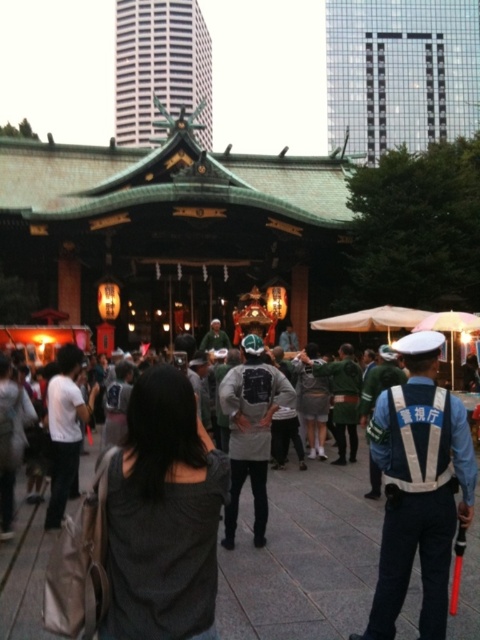
Which is below, green matte temple at upper center or dark gray fabric backpack at lower left?

Positioned lower is dark gray fabric backpack at lower left.

Is green matte temple at upper center positioned behind dark gray fabric backpack at lower left?

Yes, green matte temple at upper center is further from the viewer.

Does point (159, 49) come farther from viewer compared to point (7, 490)?

Yes, point (159, 49) is farther from viewer.

Image resolution: width=480 pixels, height=640 pixels. What are the coordinates of `green matte temple at upper center` in the screenshot? It's located at (160, 68).

Does green glazed tile temple at upper center lie behind gray fabric backpack at center?

That is True.

Who is more distant from viewer, (352,28) or (253,536)?

The point (352,28) is more distant.

Locate an element on the screen. The width and height of the screenshot is (480, 640). green glazed tile temple at upper center is located at coordinates (400, 72).

Does dark gray fabric crowd at center appear over green matte temple at upper center?

No, dark gray fabric crowd at center is not above green matte temple at upper center.

Which is above, dark gray fabric crowd at center or green matte temple at upper center?

Positioned higher is green matte temple at upper center.

Is point (380, 531) more distant than point (211, 104)?

No, (380, 531) is in front of (211, 104).

Where is `dark gray fabric crowd at center`? Image resolution: width=480 pixels, height=640 pixels. dark gray fabric crowd at center is located at coordinates (303, 557).